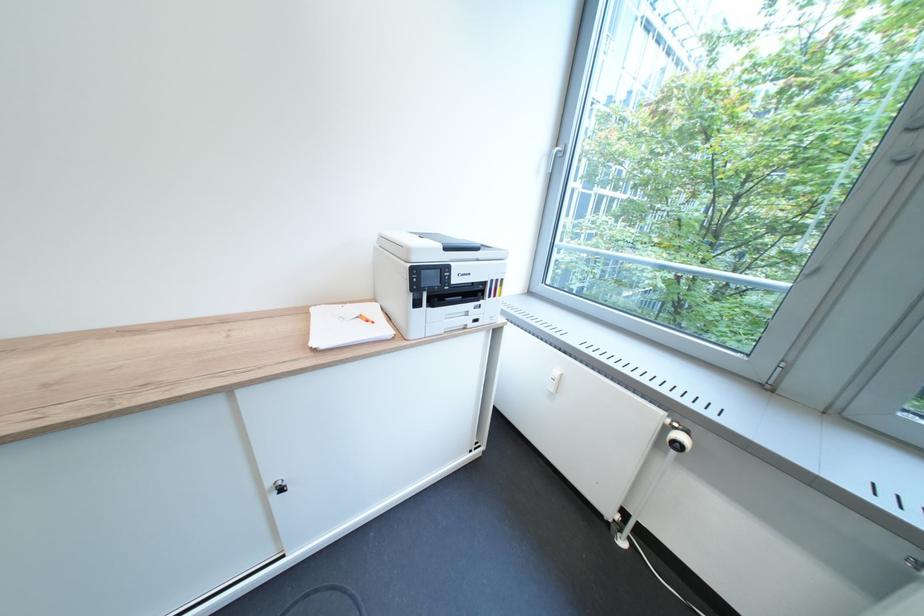
You are a GUI agent. You are given a task and a screenshot of the screen. Output one action in this format:
    pyautogui.click(x=<x>, y=<y>)
    Task: Click on the white window handle
    The height and width of the screenshot is (616, 924).
    Given the screenshot: What is the action you would take?
    pyautogui.click(x=556, y=159)